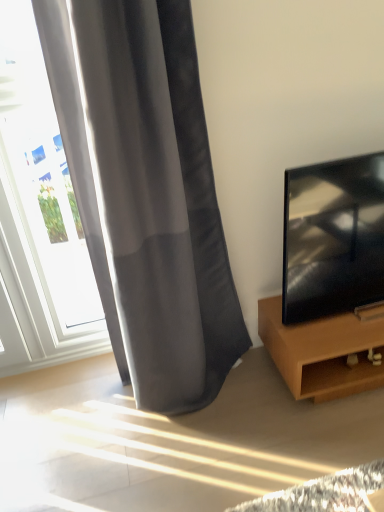
Question: Choose the correct answer: Is black glossy tv at right inside satin gray curtain at left or outside it?

Choices:
 (A) inside
 (B) outside

Answer: (B)

Question: From the image's perspective, relative to satin gray curtain at left, is black glossy tv at right above or below?

Choices:
 (A) below
 (B) above

Answer: (A)

Question: Which of these objects is positioned closest to the brown wood tv stand at right?

Choices:
 (A) black glossy tv at right
 (B) satin gray curtain at left
 (C) white glass window at left

Answer: (A)

Question: Which is nearer to the satin gray curtain at left?

Choices:
 (A) brown wood tv stand at right
 (B) white glass window at left
 (C) black glossy tv at right

Answer: (B)